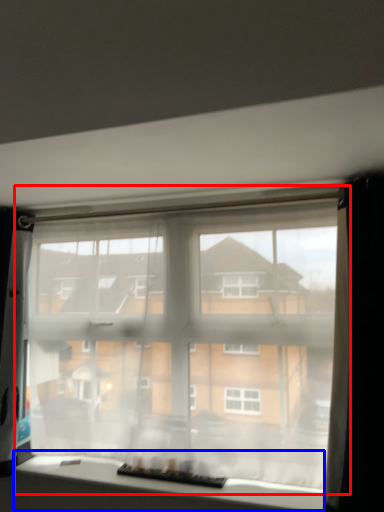
Question: Which point is further to the camera, window (highlighted by a red box) or window (highlighted by a blue box)?

Choices:
 (A) window
 (B) window

Answer: (A)